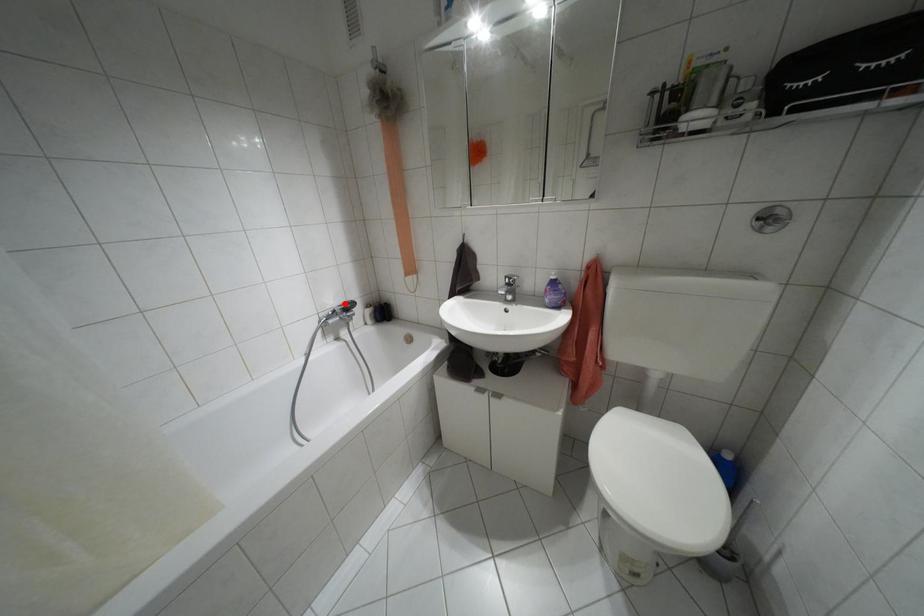
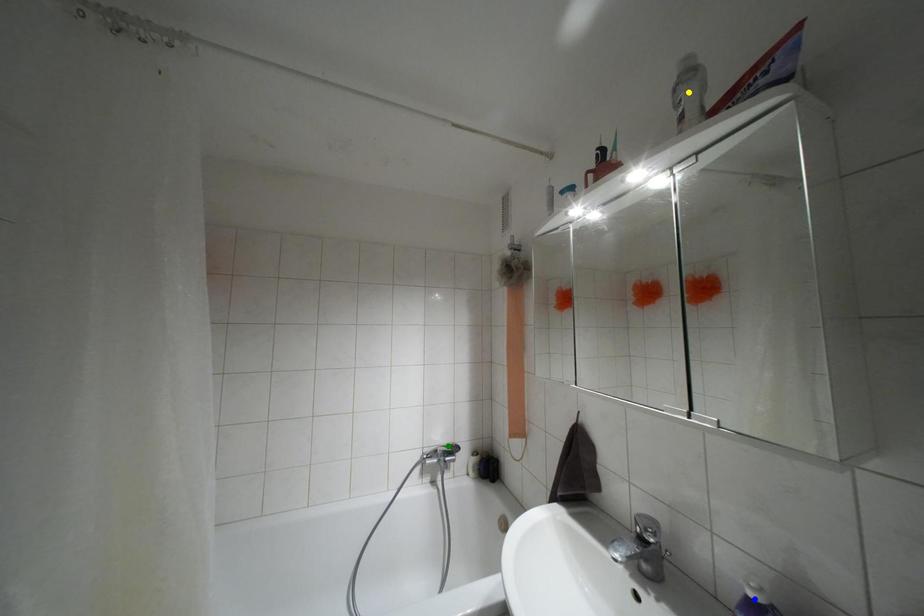
Question: I am providing you with two images of the same scene from different viewpoints. A red point is marked on the first image. You are given multiple points on the second image. Which mark in image 2 goes with the point in image 1?

Choices:
 (A) green point
 (B) blue point
 (C) yellow point

Answer: (A)